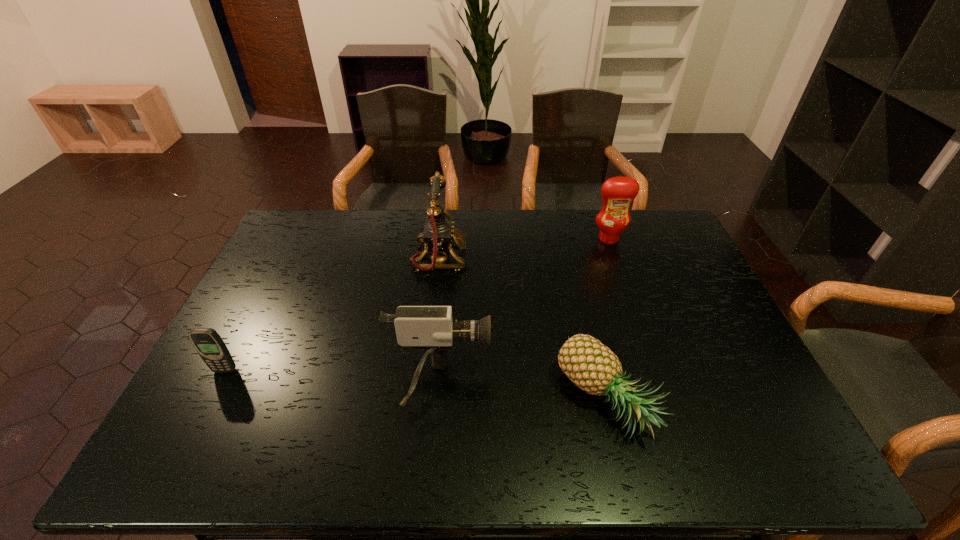
I want to click on empty location between the condiment and the telephone, so click(524, 248).

Where is `object that stands as the second closest to the telephone`? object that stands as the second closest to the telephone is located at coordinates (593, 367).

Locate which object ranks in proximity to the telephone. Please provide its 2D coordinates. Your answer should be formatted as a tuple, i.e. [(x, y)], where the tuple contains the x and y coordinates of a point satisfying the conditions above.

[(426, 328)]

Find the location of a particular element. The image size is (960, 540). vacant region that satisfies the following two spatial constraints: 1. on the recording direction of the pineapple; 2. on the left side of the third shortest object is located at coordinates (438, 400).

The height and width of the screenshot is (540, 960). Identify the location of free space that satisfies the following two spatial constraints: 1. on the screen of the pineapple; 2. on the right side of the cellular telephone. (210, 400).

Image resolution: width=960 pixels, height=540 pixels. What are the coordinates of `blank space that satisfies the following two spatial constraints: 1. on the screen of the leftmost object; 2. on the left side of the pineapple` in the screenshot? It's located at (210, 400).

Image resolution: width=960 pixels, height=540 pixels. Find the location of `vacant position in the image that satisfies the following two spatial constraints: 1. on the recording direction of the third tallest object; 2. on the back side of the pineapple`. vacant position in the image that satisfies the following two spatial constraints: 1. on the recording direction of the third tallest object; 2. on the back side of the pineapple is located at coordinates (438, 400).